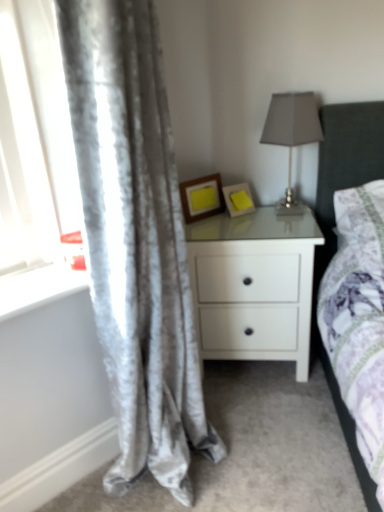
Question: In the image, is yellow matte picture frame at center, which is counted as the first picture frame, starting from the left, on the left side or the right side of satin gray lampshade at upper right?

Choices:
 (A) left
 (B) right

Answer: (A)

Question: From the image's perspective, is yellow matte picture frame at center, placed as the 2th picture frame when sorted from right to left, above or below satin gray lampshade at upper right?

Choices:
 (A) above
 (B) below

Answer: (B)

Question: Estimate the real-world distances between objects in this image. Which object is closer to the yellow matte picture frame at upper center, which ranks as the first picture frame in right-to-left order?

Choices:
 (A) satin gray lampshade at upper right
 (B) white glossy nightstand at center
 (C) white glossy window sill at lower left
 (D) silvery velvet curtains at left
 (E) yellow matte picture frame at center, which is counted as the first picture frame, starting from the left

Answer: (E)

Question: Which object is positioned closest to the yellow matte picture frame at center, placed as the 2th picture frame when sorted from right to left?

Choices:
 (A) yellow matte picture frame at upper center, which ranks as the first picture frame in right-to-left order
 (B) silvery velvet curtains at left
 (C) white glossy window sill at lower left
 (D) satin gray lampshade at upper right
 (E) white glossy nightstand at center

Answer: (A)